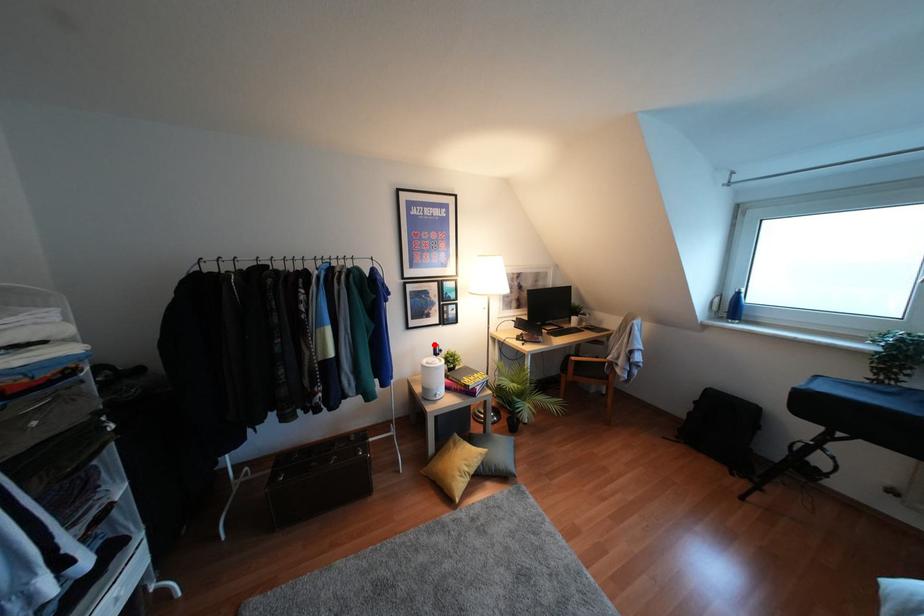
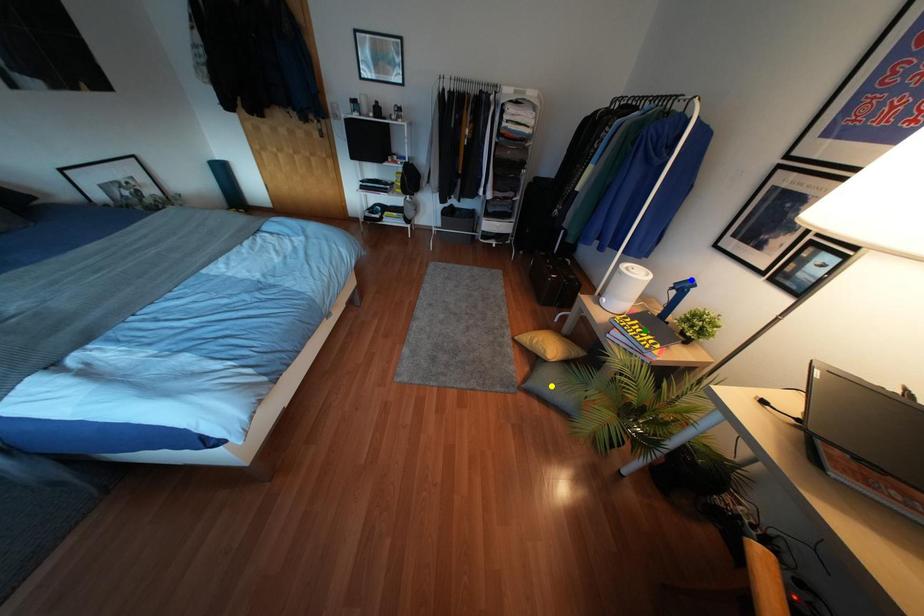
Question: I am providing you with two images of the same scene from different viewpoints. A red point is marked on the first image. You are given multiple points on the second image. Which point in image 2 is actually the same real-world point as the red point in image 1?

Choices:
 (A) yellow point
 (B) blue point
 (C) green point

Answer: (B)